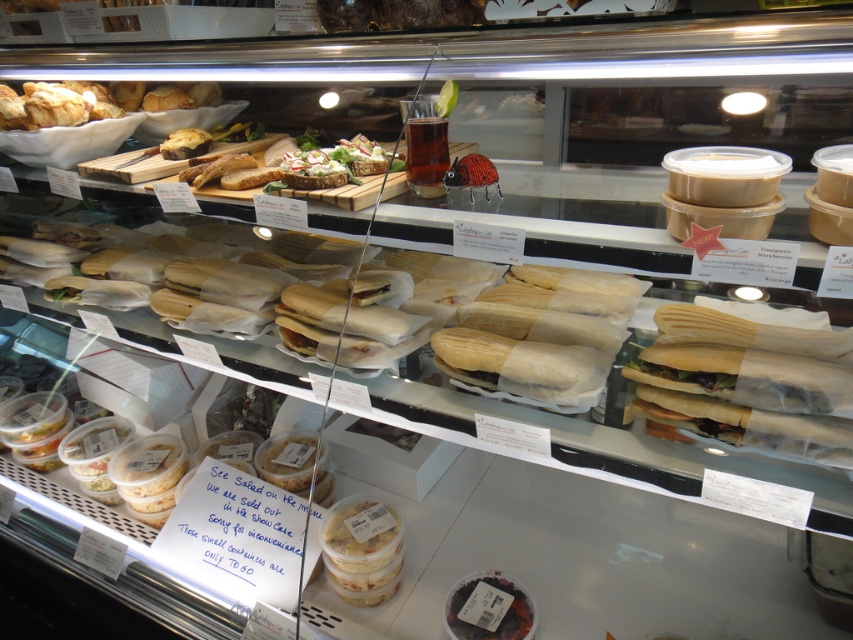
Question: Does translucent plastic salad container at center appear on the right side of dark purple matte cake at lower center?

Choices:
 (A) yes
 (B) no

Answer: (B)

Question: Which point is farther to the camera?

Choices:
 (A) (164, 84)
 (B) (486, 605)
 (C) (344, 538)

Answer: (A)

Question: Which is farther from the golden brown croissant at upper left?

Choices:
 (A) translucent plastic salad container at center
 (B) dark purple matte cake at lower center

Answer: (B)

Question: Does translucent plastic salad container at center appear over dark purple matte cake at lower center?

Choices:
 (A) no
 (B) yes

Answer: (B)

Question: Is golden brown croissant at upper left closer to camera compared to dark purple matte cake at lower center?

Choices:
 (A) no
 (B) yes

Answer: (A)

Question: Which point is closer to the camera?

Choices:
 (A) translucent plastic salad container at center
 (B) golden brown croissant at upper left

Answer: (A)